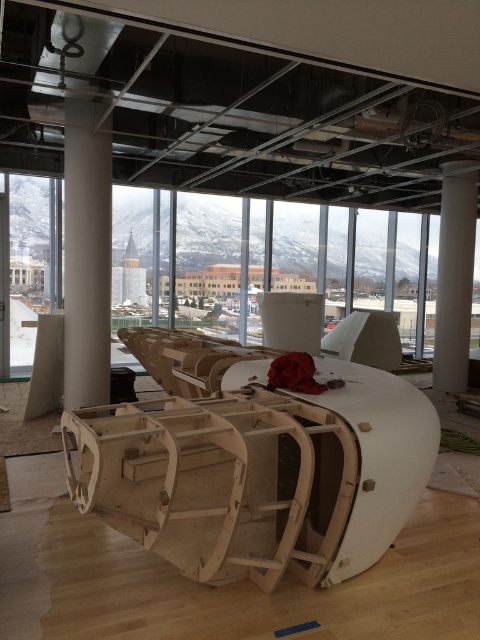
Is point (192, 472) positioned behind point (92, 120)?

No, it is not.

Can you confirm if natural wood boat at center is positioned to the right of white smooth column at left?

Indeed, natural wood boat at center is positioned on the right side of white smooth column at left.

The image size is (480, 640). Describe the element at coordinates (260, 474) in the screenshot. I see `natural wood boat at center` at that location.

The height and width of the screenshot is (640, 480). What are the coordinates of `natural wood boat at center` in the screenshot? It's located at (260, 474).

Does white smooth column at left have a greater height compared to white smooth column at center?

No.

Is white smooth column at left shorter than white smooth column at center?

Correct, white smooth column at left is not as tall as white smooth column at center.

Is point (66, 288) positioned after point (463, 324)?

No, it is not.

Where is `white smooth column at left`? white smooth column at left is located at coordinates click(86, 253).

Can you confirm if natural wood boat at center is wider than white smooth column at center?

Indeed, natural wood boat at center has a greater width compared to white smooth column at center.

Who is more distant from viewer, [423,461] or [470,289]?

Positioned behind is point [470,289].

Where is `natural wood boat at center`? This screenshot has height=640, width=480. natural wood boat at center is located at coordinates (260, 474).